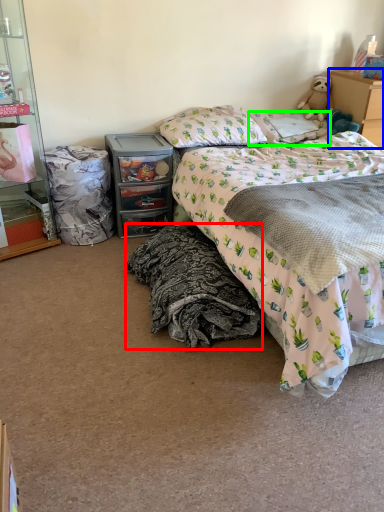
Question: Which object is positioned farthest from blanket (highlighted by a red box)? Select from chest of drawers (highlighted by a blue box) and pillow (highlighted by a green box).

Choices:
 (A) chest of drawers
 (B) pillow

Answer: (A)